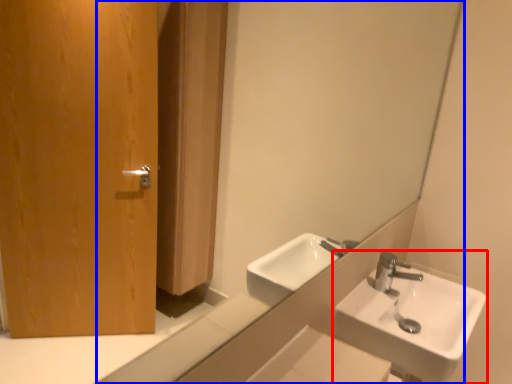
Question: Among these objects, which one is farthest to the camera, sink (highlighted by a red box) or mirror (highlighted by a blue box)?

Choices:
 (A) sink
 (B) mirror

Answer: (A)